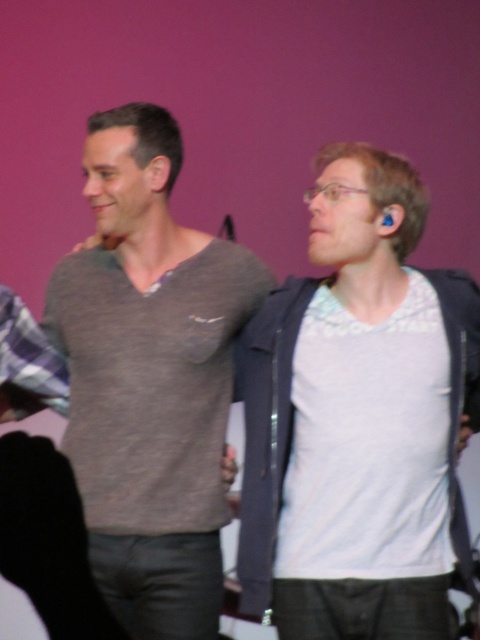
Is point (170, 406) behind point (286, 467)?

Yes, it is.

Which is in front, point (90, 426) or point (272, 516)?

Positioned in front is point (272, 516).

This screenshot has width=480, height=640. In order to click on gray soft sweater at center in this screenshot , I will do `click(149, 378)`.